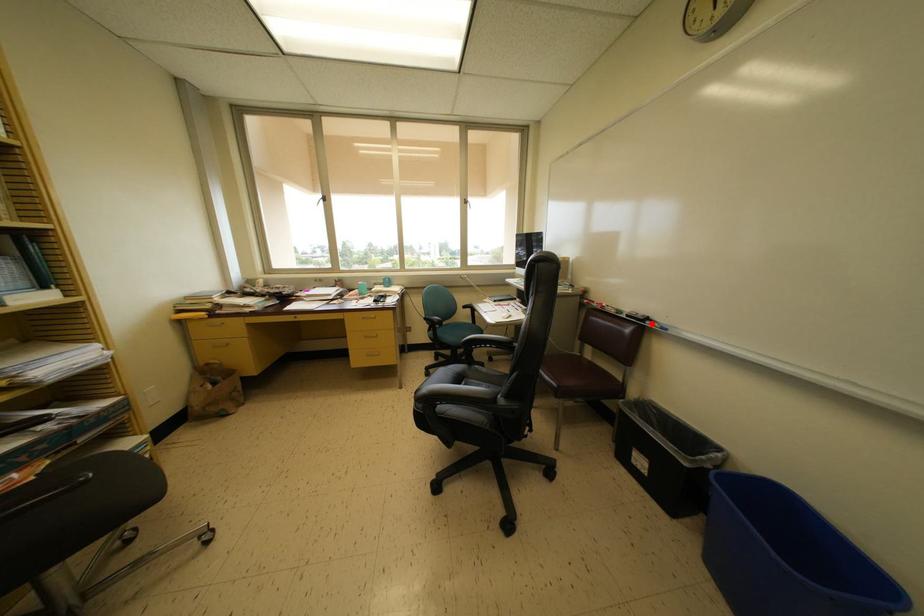
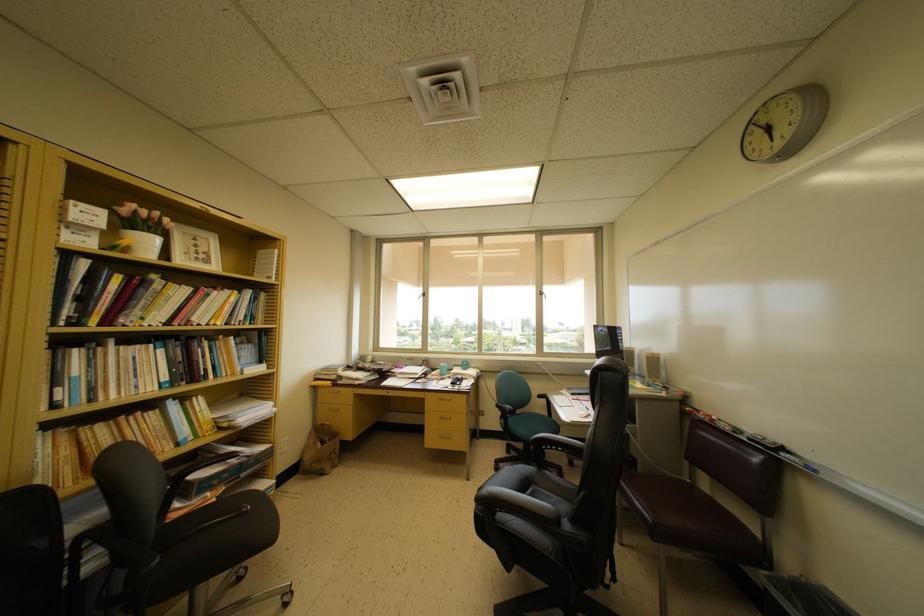
Where in the second image is the point corresponding to the highlighted location from the first image?

(786, 454)